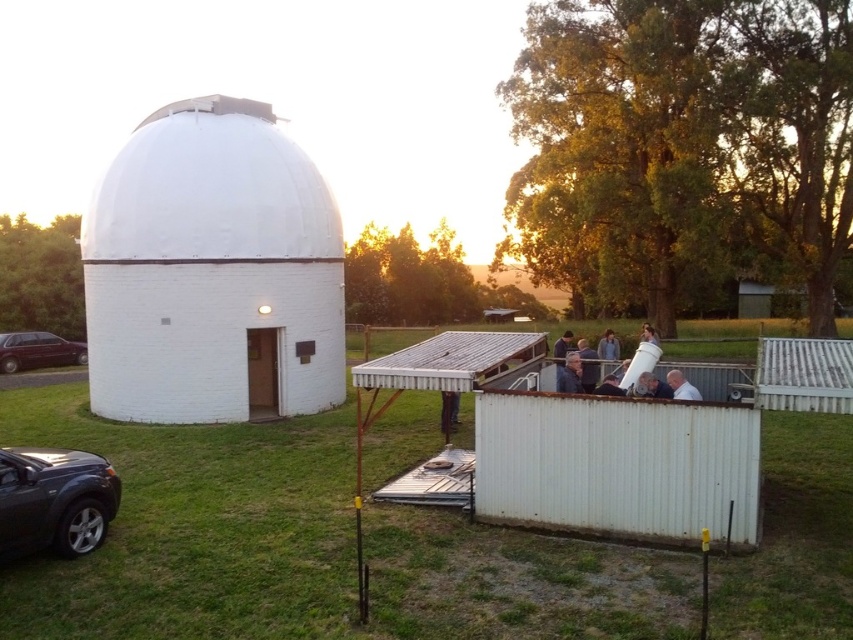
Can you confirm if white brick observatory at left is bigger than shiny maroon sedan at lower left?

Yes, white brick observatory at left is bigger than shiny maroon sedan at lower left.

Which of these two, white brick observatory at left or shiny maroon sedan at lower left, stands taller?

Standing taller between the two is white brick observatory at left.

What do you see at coordinates (212, 272) in the screenshot?
I see `white brick observatory at left` at bounding box center [212, 272].

Find the location of `white brick observatory at left`. white brick observatory at left is located at coordinates (212, 272).

Is shiny maroon sedan at lower left to the right of light brown wooden telescope at center from the viewer's perspective?

In fact, shiny maroon sedan at lower left is to the left of light brown wooden telescope at center.

From the picture: Is shiny maroon sedan at lower left taller than light brown wooden telescope at center?

Correct, shiny maroon sedan at lower left is much taller as light brown wooden telescope at center.

Who is more forward, (85, 364) or (691, 392)?

Point (691, 392) is in front.

Locate an element on the screen. This screenshot has height=640, width=853. shiny maroon sedan at lower left is located at coordinates (38, 352).

Is metallic gray car at lower left taller than shiny maroon sedan at lower left?

In fact, metallic gray car at lower left may be shorter than shiny maroon sedan at lower left.

Looking at this image, does metallic gray car at lower left have a lesser height compared to shiny maroon sedan at lower left?

Yes, metallic gray car at lower left is shorter than shiny maroon sedan at lower left.

In order to click on metallic gray car at lower left in this screenshot , I will do `click(54, 500)`.